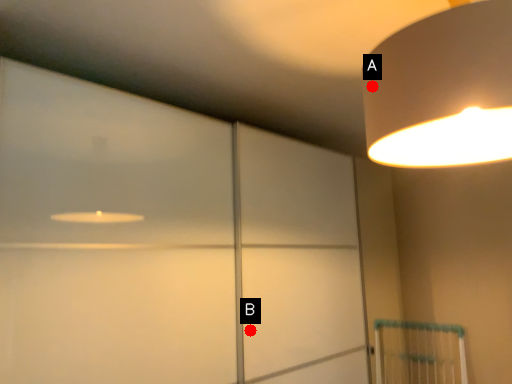
Question: Two points are circled on the image, labeled by A and B beside each circle. Which point is closer to the camera?

Choices:
 (A) A is closer
 (B) B is closer

Answer: (A)